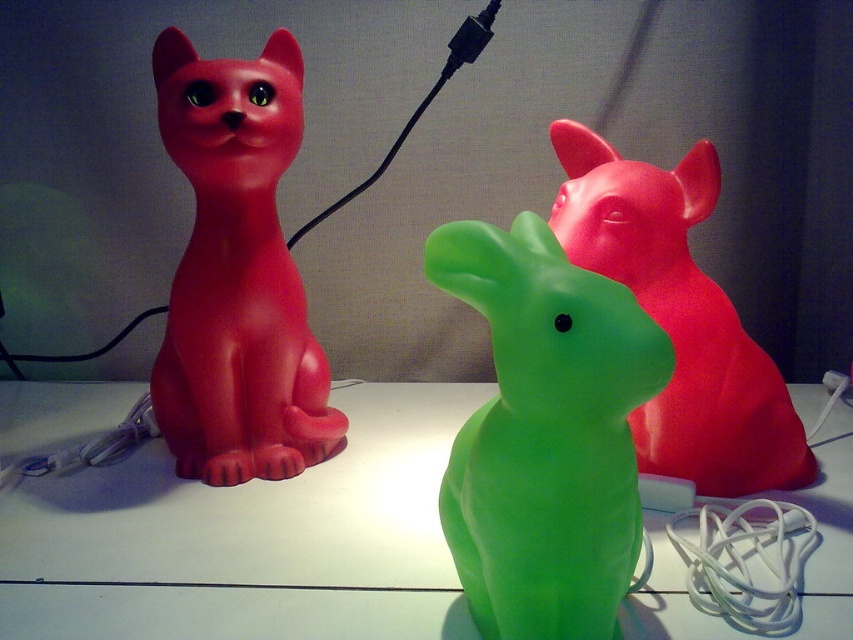
You are organizing a display and need to place a new figurine between the green translucent cat at center and the green translucent rabbit at center. Considering their sizes, which one should you place the new figurine closer to to ensure it fits properly?

The green translucent cat at center is wider than the green translucent rabbit at center, so placing the new figurine closer to the rabbit would leave more space for the larger cat, ensuring proper fit.

You are trying to place a sticker exactly at point (236, 275) on the white surface. However, there are two red cat figurines and one green rabbit in the scene. Which object will the sticker land on?

The sticker will land on the matte plastic cat at left because the point (236, 275) is on that object according to the description.

You are looking at the image of the three figurines. There are two points marked in the image. Which of the two points, point (635, 548) or point (222, 72), is closer to you?

Point (635, 548) is closer to you than point (222, 72).